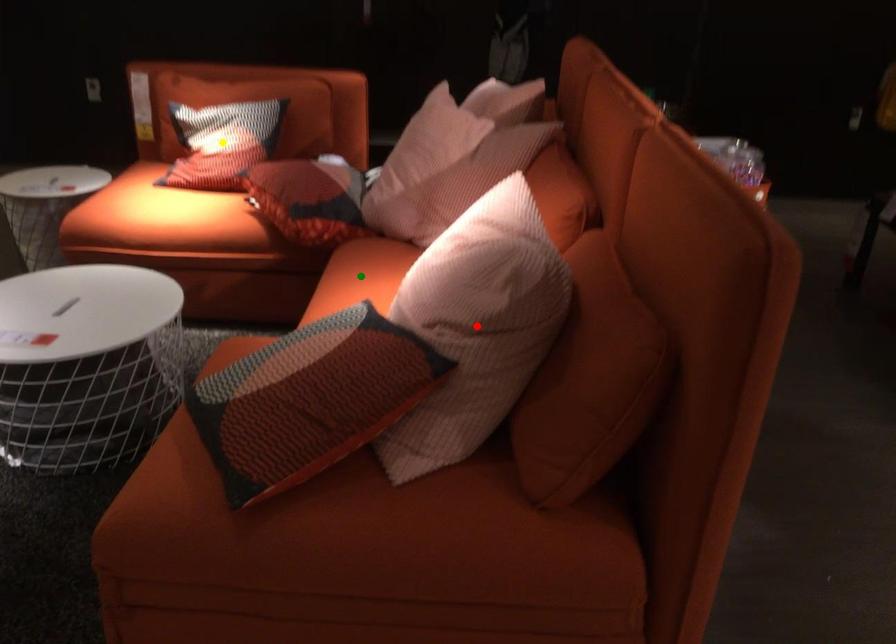
Order these from nearest to farthest:
yellow point, red point, green point

red point < green point < yellow point